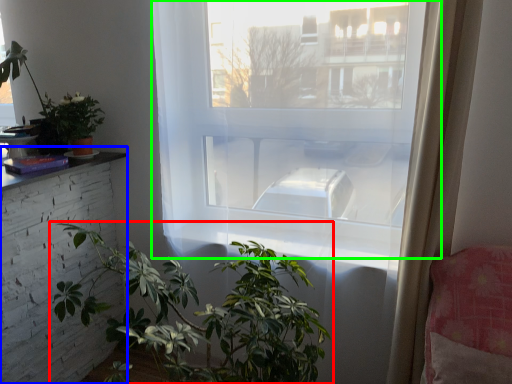
Question: Which object is positioned closest to houseplant (highlighted by a red box)? Select from table (highlighted by a blue box) and window (highlighted by a green box).

Choices:
 (A) table
 (B) window

Answer: (B)